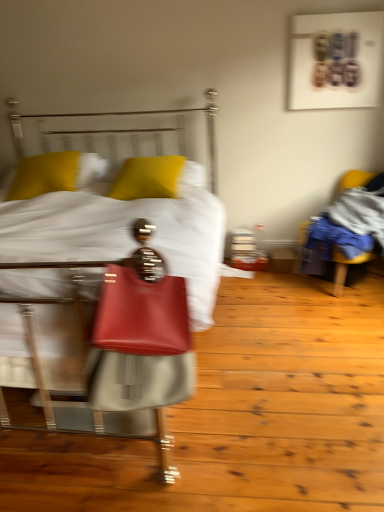
Question: From the image's perspective, is yellow matte pillow at upper left, which appears as the 2th pillow when viewed from the right, beneath matte leather bed at center?

Choices:
 (A) no
 (B) yes

Answer: (A)

Question: Can you confirm if yellow matte pillow at upper left, marked as the 1th pillow in a left-to-right arrangement, is smaller than matte leather bed at center?

Choices:
 (A) no
 (B) yes

Answer: (B)

Question: Is yellow matte pillow at upper left, which appears as the 2th pillow when viewed from the right, wider than matte leather bed at center?

Choices:
 (A) no
 (B) yes

Answer: (A)

Question: Could you tell me if yellow matte pillow at upper left, marked as the 1th pillow in a left-to-right arrangement, is facing matte leather bed at center?

Choices:
 (A) yes
 (B) no

Answer: (A)

Question: Is yellow matte pillow at upper left, which appears as the 2th pillow when viewed from the right, taller than matte leather bed at center?

Choices:
 (A) no
 (B) yes

Answer: (A)

Question: From the image's perspective, is yellow matte pillow at upper left, marked as the 1th pillow in a left-to-right arrangement, over matte leather bed at center?

Choices:
 (A) yes
 (B) no

Answer: (A)

Question: Considering the relative sizes of yellow fabric chair at right and matte leather bed at center in the image provided, is yellow fabric chair at right shorter than matte leather bed at center?

Choices:
 (A) yes
 (B) no

Answer: (A)

Question: Does yellow fabric chair at right have a greater width compared to matte leather bed at center?

Choices:
 (A) yes
 (B) no

Answer: (B)

Question: Is the surface of yellow fabric chair at right in direct contact with matte leather bed at center?

Choices:
 (A) no
 (B) yes

Answer: (A)

Question: Is yellow fabric chair at right positioned behind matte leather bed at center?

Choices:
 (A) no
 (B) yes

Answer: (B)

Question: Is yellow fabric chair at right not within matte leather bed at center?

Choices:
 (A) yes
 (B) no

Answer: (A)

Question: Is yellow fabric chair at right taller than matte leather bed at center?

Choices:
 (A) no
 (B) yes

Answer: (A)

Question: Is yellow fabric chair at right inside matte red handbag at center?

Choices:
 (A) no
 (B) yes

Answer: (A)